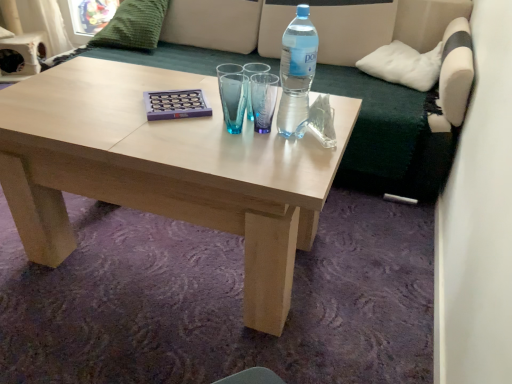
Question: Is transparent plastic bottle at upper right taller than white soft cushion at upper right, arranged as the second pillow when viewed from the left?

Choices:
 (A) yes
 (B) no

Answer: (A)

Question: Considering the relative sizes of transparent plastic bottle at upper right and white soft cushion at upper right, arranged as the second pillow when viewed from the left, in the image provided, is transparent plastic bottle at upper right wider than white soft cushion at upper right, arranged as the second pillow when viewed from the left,?

Choices:
 (A) yes
 (B) no

Answer: (B)

Question: Does transparent plastic bottle at upper right lie behind white soft cushion at upper right, arranged as the first pillow when viewed from the right?

Choices:
 (A) yes
 (B) no

Answer: (B)

Question: Considering the relative sizes of transparent plastic bottle at upper right and white soft cushion at upper right, arranged as the second pillow when viewed from the left, in the image provided, is transparent plastic bottle at upper right thinner than white soft cushion at upper right, arranged as the second pillow when viewed from the left,?

Choices:
 (A) no
 (B) yes

Answer: (B)

Question: From a real-world perspective, does transparent plastic bottle at upper right stand above white soft cushion at upper right, arranged as the first pillow when viewed from the right?

Choices:
 (A) yes
 (B) no

Answer: (A)

Question: Considering the relative sizes of transparent plastic bottle at upper right and white soft cushion at upper right, arranged as the second pillow when viewed from the left, in the image provided, is transparent plastic bottle at upper right shorter than white soft cushion at upper right, arranged as the second pillow when viewed from the left,?

Choices:
 (A) no
 (B) yes

Answer: (A)

Question: Considering the relative sizes of white soft cushion at upper right, the second pillow from the top, and green knitted pillow at upper left, the second pillow positioned from the bottom, in the image provided, is white soft cushion at upper right, the second pillow from the top, bigger than green knitted pillow at upper left, the second pillow positioned from the bottom,?

Choices:
 (A) no
 (B) yes

Answer: (A)

Question: Can you see white soft cushion at upper right, marked as the 1th pillow in a bottom-to-top arrangement, touching green knitted pillow at upper left, arranged as the first pillow when viewed from the left?

Choices:
 (A) yes
 (B) no

Answer: (B)

Question: Is white soft cushion at upper right, the second pillow from the top, looking in the opposite direction of green knitted pillow at upper left, which ranks as the first pillow in top-to-bottom order?

Choices:
 (A) yes
 (B) no

Answer: (B)

Question: Would you say white soft cushion at upper right, the second pillow from the top, is outside green knitted pillow at upper left, which ranks as the first pillow in top-to-bottom order?

Choices:
 (A) yes
 (B) no

Answer: (A)

Question: Does white soft cushion at upper right, marked as the 1th pillow in a bottom-to-top arrangement, have a lesser height compared to green knitted pillow at upper left, which ranks as the first pillow in top-to-bottom order?

Choices:
 (A) yes
 (B) no

Answer: (A)

Question: From a real-world perspective, is white soft cushion at upper right, the second pillow from the top, physically below green knitted pillow at upper left, which ranks as the first pillow in top-to-bottom order?

Choices:
 (A) no
 (B) yes

Answer: (B)

Question: From a real-world perspective, is green fabric couch at upper center below green knitted pillow at upper left, marked as the second pillow in a right-to-left arrangement?

Choices:
 (A) yes
 (B) no

Answer: (A)